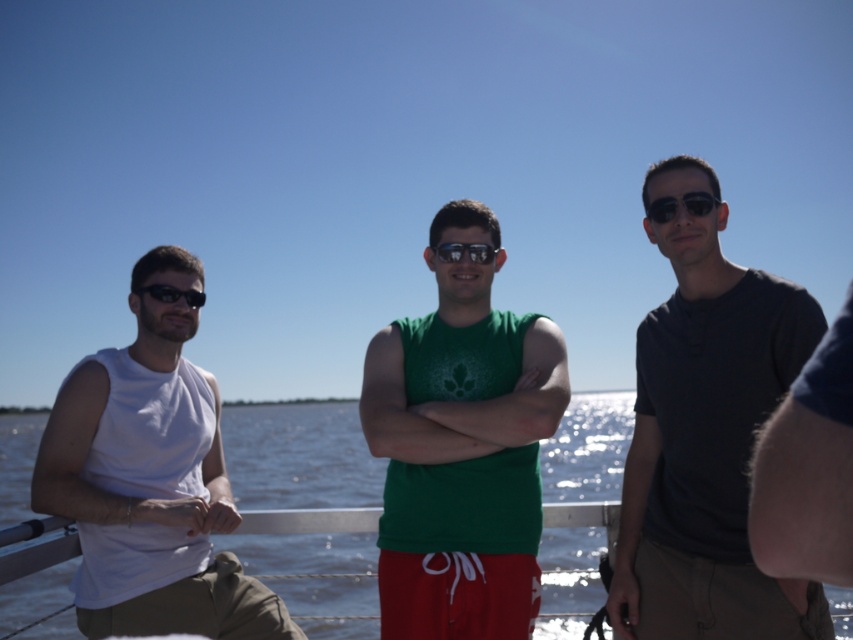
Question: Is matte black t-shirt at right to the left of black reflective sunglasses at center from the viewer's perspective?

Choices:
 (A) no
 (B) yes

Answer: (A)

Question: Estimate the real-world distances between objects in this image. Which object is farther from the matte black t-shirt at right?

Choices:
 (A) white matte tank top at left
 (B) black reflective sunglasses at center
 (C) clear blue water at center

Answer: (C)

Question: Which point is farther from the camera taking this photo?

Choices:
 (A) (477, 243)
 (B) (149, 296)
 (C) (129, 388)
 (D) (540, 346)

Answer: (B)

Question: Which point is closer to the camera taking this photo?

Choices:
 (A) (381, 628)
 (B) (167, 284)

Answer: (A)

Question: Can you confirm if matte black t-shirt at right is smaller than green matte tank top at center?

Choices:
 (A) yes
 (B) no

Answer: (B)

Question: In this image, where is matte black t-shirt at right located relative to clear blue water at center?

Choices:
 (A) right
 (B) left

Answer: (A)